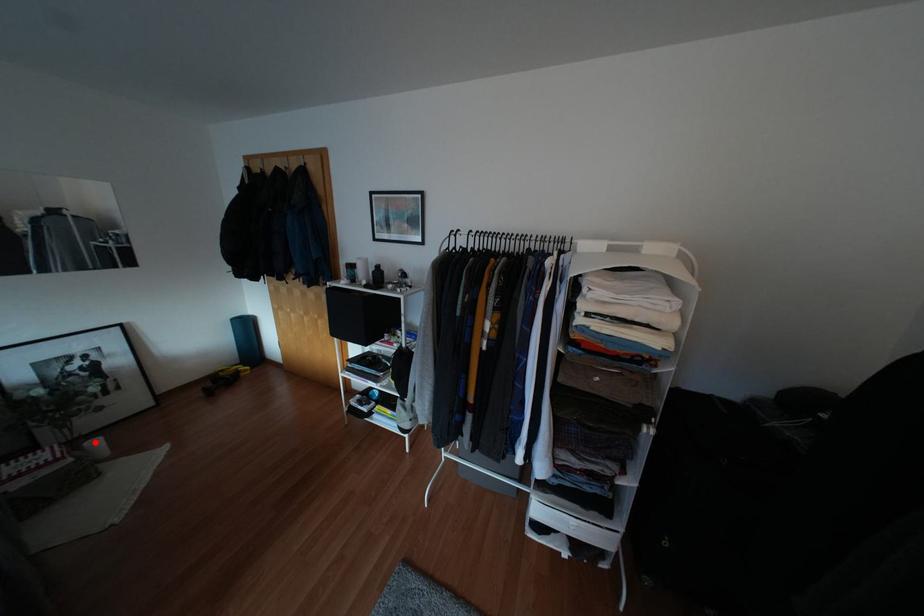
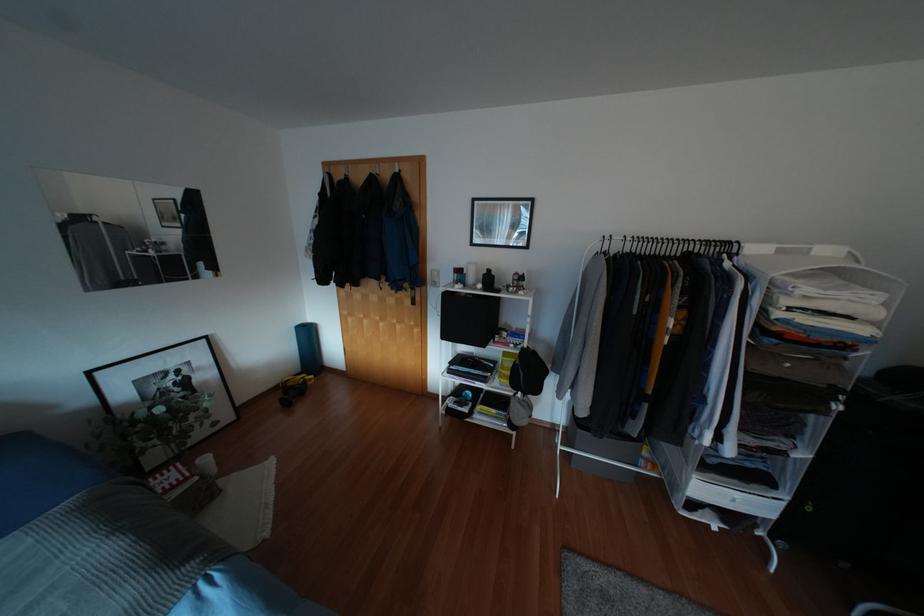
Find the pixel in the second image that matches the highlighted location in the first image.

(205, 459)